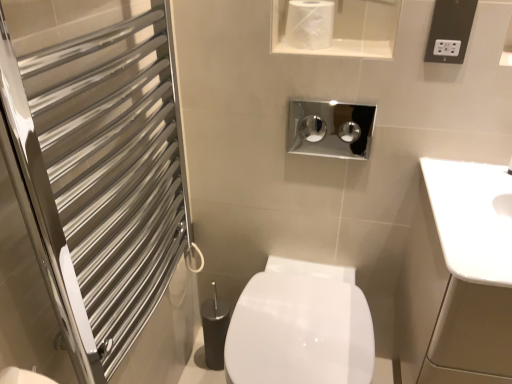
Question: Is silver metallic towel rack at left behind white glossy toilet paper at upper center?

Choices:
 (A) yes
 (B) no

Answer: (B)

Question: Can you confirm if silver metallic towel rack at left is shorter than white glossy toilet paper at upper center?

Choices:
 (A) no
 (B) yes

Answer: (A)

Question: From the image's perspective, is silver metallic towel rack at left over white glossy toilet paper at upper center?

Choices:
 (A) no
 (B) yes

Answer: (A)

Question: Considering the relative positions of silver metallic towel rack at left and white glossy toilet paper at upper center in the image provided, is silver metallic towel rack at left to the right of white glossy toilet paper at upper center from the viewer's perspective?

Choices:
 (A) yes
 (B) no

Answer: (B)

Question: From a real-world perspective, is silver metallic towel rack at left physically below white glossy toilet paper at upper center?

Choices:
 (A) yes
 (B) no

Answer: (A)

Question: Is silver metallic towel rack at left bigger than white glossy toilet paper at upper center?

Choices:
 (A) no
 (B) yes

Answer: (B)

Question: Could you tell me if black plastic electrical outlet at upper right is turned towards white glossy bidet at center?

Choices:
 (A) no
 (B) yes

Answer: (A)

Question: Considering the relative sizes of black plastic electrical outlet at upper right and white glossy bidet at center in the image provided, is black plastic electrical outlet at upper right smaller than white glossy bidet at center?

Choices:
 (A) no
 (B) yes

Answer: (B)

Question: Are black plastic electrical outlet at upper right and white glossy bidet at center located far from each other?

Choices:
 (A) yes
 (B) no

Answer: (B)

Question: From the image's perspective, is black plastic electrical outlet at upper right on top of white glossy bidet at center?

Choices:
 (A) yes
 (B) no

Answer: (A)

Question: Is black plastic electrical outlet at upper right closer to the viewer compared to white glossy bidet at center?

Choices:
 (A) yes
 (B) no

Answer: (B)

Question: From a real-world perspective, is black plastic electrical outlet at upper right over white glossy bidet at center?

Choices:
 (A) yes
 (B) no

Answer: (A)

Question: Does black plastic electrical outlet at upper right come behind silver metallic towel rack at left?

Choices:
 (A) yes
 (B) no

Answer: (A)